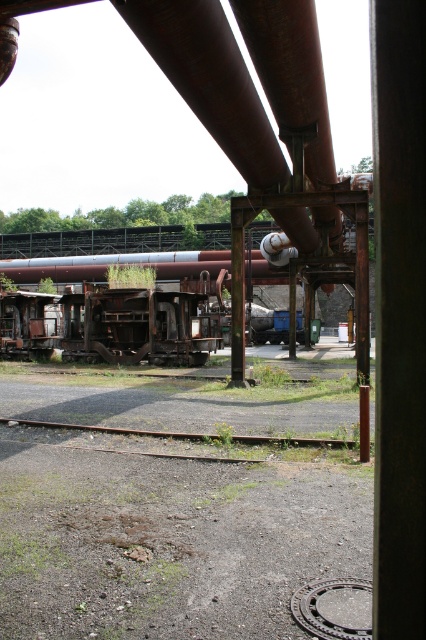
From the picture: You are a maintenance worker inspecting the industrial site. You notice the rusty metal train car at center and the rusty metal train track at lower center. Which object is positioned higher relative to the other?

The rusty metal train car at center is above the rusty metal train track at lower center, so it is positioned higher.

You are standing at the point marked by the coordinates (399, 316) in this industrial area. Looking around, you see a gravelly foreground with a partially visible manhole cover on the right side and railway tracks running through the middle. There are also weathered machinery pieces in the midground. What object is directly in front of you at your current position?

The point marked by the coordinates (399, 316) directly in front of you is the rusty metal pole at center.